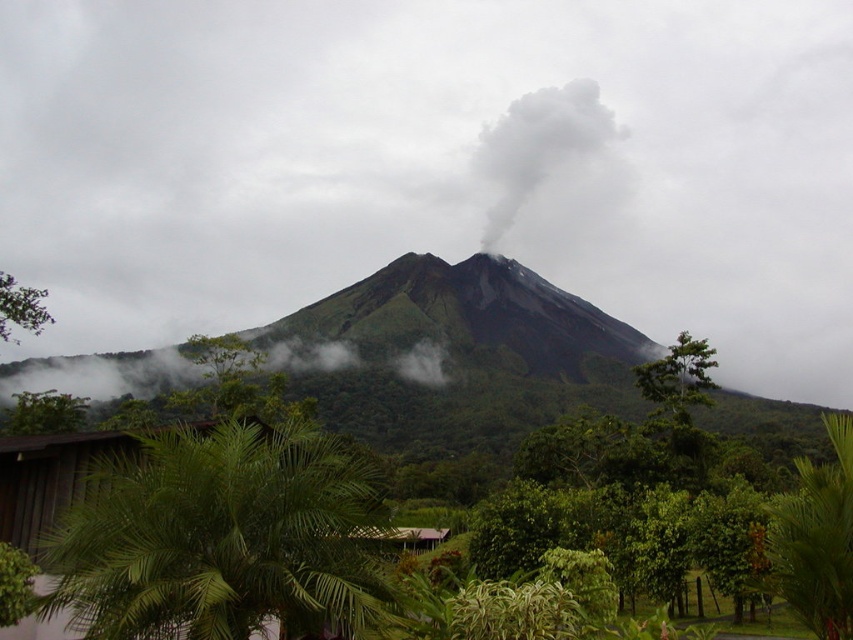
Which of these two, gray ash cloud at center or green leafy palm at lower left, stands shorter?

green leafy palm at lower left

From the picture: Can you confirm if gray ash cloud at center is positioned to the left of green leafy palm at lower left?

Correct, you'll find gray ash cloud at center to the left of green leafy palm at lower left.

Image resolution: width=853 pixels, height=640 pixels. Identify the location of gray ash cloud at center. (436, 163).

Is white smoke at center taller than green leafy tree at lower left?

Correct, white smoke at center is much taller as green leafy tree at lower left.

Where is `white smoke at center`? The image size is (853, 640). white smoke at center is located at coordinates (538, 147).

Can you confirm if green leafy palm at lower left is positioned to the right of green leafy tree at lower left?

Correct, you'll find green leafy palm at lower left to the right of green leafy tree at lower left.

Which is above, green leafy palm at lower left or green leafy tree at lower left?

Positioned higher is green leafy tree at lower left.

Between point (241, 477) and point (25, 294), which one is positioned in front?

Point (241, 477)

At what (x,y) coordinates should I click in order to perform the action: click on green leafy palm at lower left. Please return your answer as a coordinate pair (x, y). Looking at the image, I should click on (222, 536).